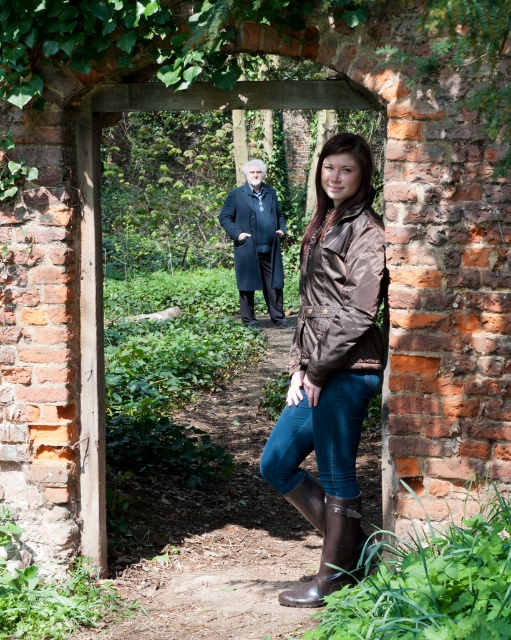
Is point (291, 364) behind point (227, 204)?

No, it is not.

Does brown leather jacket at center have a lesser width compared to dark blue wool coat at center?

Yes, brown leather jacket at center is thinner than dark blue wool coat at center.

Where is `brown leather jacket at center`? brown leather jacket at center is located at coordinates (340, 298).

The width and height of the screenshot is (511, 640). What do you see at coordinates (332, 362) in the screenshot? I see `brown satin jacket at center` at bounding box center [332, 362].

Is point (350, 164) closer to viewer compared to point (321, 358)?

No, (350, 164) is further to viewer.

Find the location of a particular element. brown satin jacket at center is located at coordinates (332, 362).

Between brown satin jacket at center and dark blue wool coat at center, which one appears on the left side from the viewer's perspective?

Positioned to the left is dark blue wool coat at center.

Describe the element at coordinates (332, 362) in the screenshot. I see `brown satin jacket at center` at that location.

The width and height of the screenshot is (511, 640). What are the coordinates of `brown satin jacket at center` in the screenshot? It's located at (332, 362).